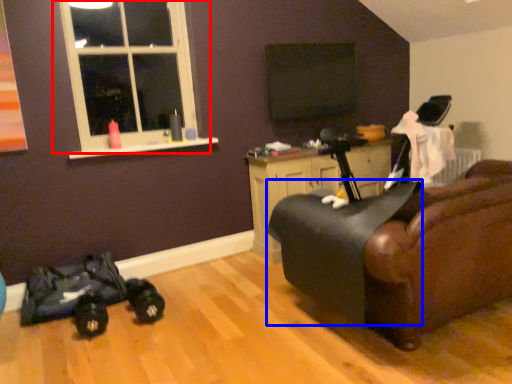
Question: Which object appears farthest to the camera in this image, window (highlighted by a red box) or swivel chair (highlighted by a blue box)?

Choices:
 (A) window
 (B) swivel chair

Answer: (A)